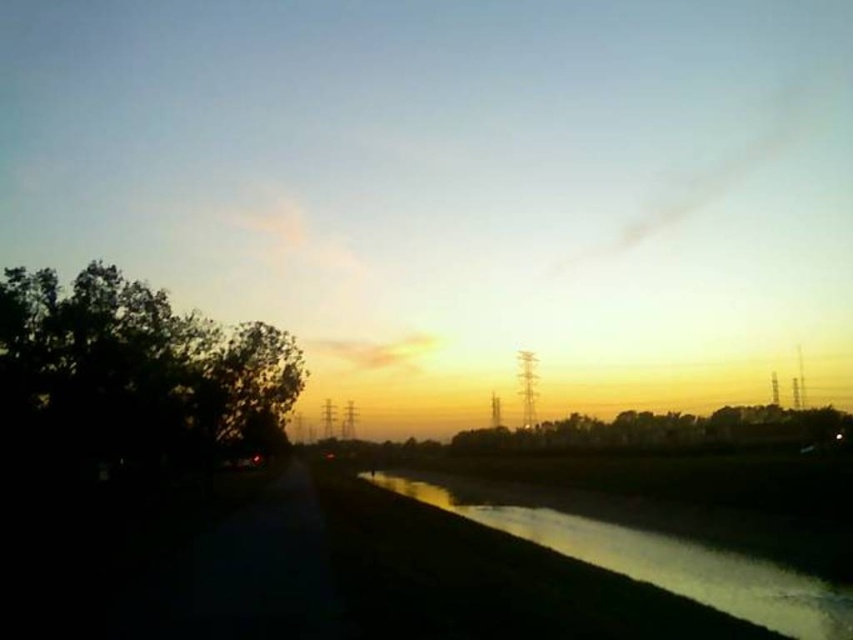
You are an artist trying to paint the scene. You need to decide which object to sketch first based on their size. Which one should you start with, the dark green leafy tree at left or the silvery reflective water at lower right?

The dark green leafy tree at left is larger in size than the silvery reflective water at lower right, so you should start with the dark green leafy tree at left because it requires more attention due to its larger size.

Based on the scene description, where is the dark green leafy tree located in relation to the point marked at coordinates (134,374)?

The dark green leafy tree is located at the coordinates marked by point (134,374), which places it at the left side of the scene.

You are standing at the edge of the water and want to take a photo of the dark green leafy tree at left and the silvery reflective water at lower right. Which object should you point your camera towards first to capture both in the same frame?

You should point your camera towards the dark green leafy tree at left first because it is located above the silvery reflective water at lower right, so adjusting the angle to include both would require framing from the top downward.